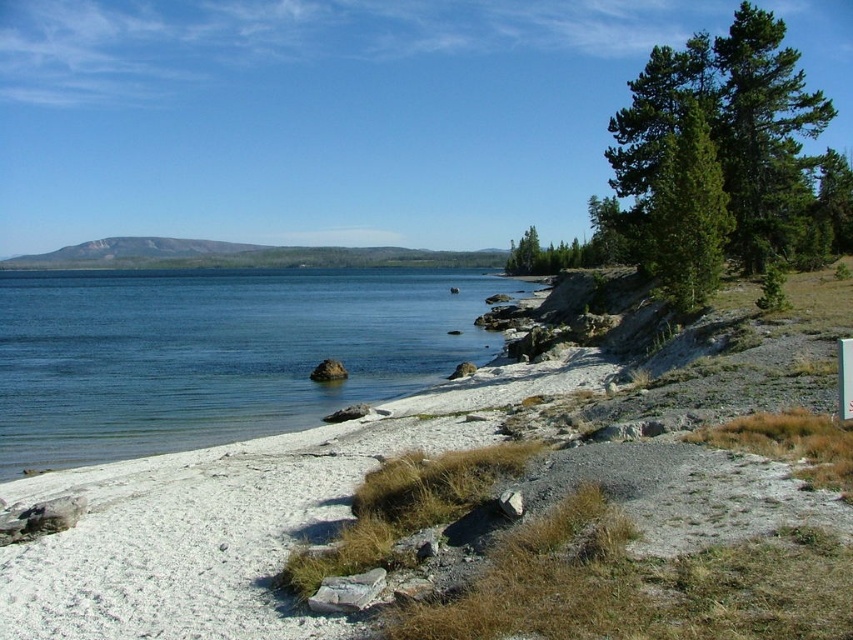
You are a hiker planning to walk from the white gravelly sand at lower left to the green textured pine tree at upper right. Given that your average walking pace is 3 feet per second, how many seconds will it take you to reach the tree?

The distance between the white gravelly sand at lower left and the green textured pine tree at upper right is 31.06 feet. At a pace of 3 feet per second, dividing the distance by the pace gives approximately 10.35 seconds. Rounding to the nearest whole number, it would take about 10 seconds to reach the tree.

You are standing on the white gravelly sand at lower left and want to reach the blue water at lower left. Based on the scene description, can you step into the water directly from your current position?

The white gravelly sand at lower left is positioned under the blue water at lower left, so yes, you can step into the water directly from your current position on the white gravelly sand at lower left.